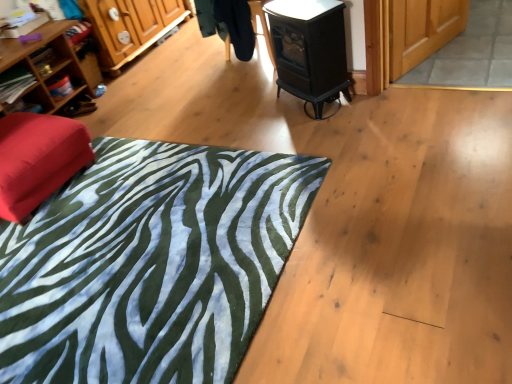
Question: From the image's perspective, would you say wooden bookshelf at left, positioned as the first shelf in top-to-bottom order, is positioned over green zebra-patterned rug at lower left?

Choices:
 (A) no
 (B) yes

Answer: (B)

Question: Is green zebra-patterned rug at lower left a part of wooden bookshelf at left, positioned as the first shelf in top-to-bottom order?

Choices:
 (A) no
 (B) yes

Answer: (A)

Question: From a real-world perspective, is wooden bookshelf at left, positioned as the first shelf in top-to-bottom order, positioned under green zebra-patterned rug at lower left based on gravity?

Choices:
 (A) no
 (B) yes

Answer: (A)

Question: Considering the relative positions of wooden bookshelf at left, positioned as the first shelf in top-to-bottom order, and green zebra-patterned rug at lower left in the image provided, is wooden bookshelf at left, positioned as the first shelf in top-to-bottom order, to the right of green zebra-patterned rug at lower left from the viewer's perspective?

Choices:
 (A) no
 (B) yes

Answer: (A)

Question: Considering the relative sizes of wooden bookshelf at left, arranged as the 3th shelf when ordered from the bottom, and green zebra-patterned rug at lower left in the image provided, is wooden bookshelf at left, arranged as the 3th shelf when ordered from the bottom, thinner than green zebra-patterned rug at lower left?

Choices:
 (A) yes
 (B) no

Answer: (A)

Question: From the image's perspective, is wooden shelf at left, the first shelf in the bottom-to-top sequence, positioned above or below wooden shelf at left, arranged as the 2th shelf when ordered from the bottom?

Choices:
 (A) below
 (B) above

Answer: (A)

Question: Looking at the image, does wooden shelf at left, the first shelf in the bottom-to-top sequence, seem bigger or smaller compared to wooden shelf at left, arranged as the 2th shelf when ordered from the bottom?

Choices:
 (A) small
 (B) big

Answer: (B)

Question: Choose the correct answer: Is wooden shelf at left, the 3th shelf from the top, inside wooden shelf at left, arranged as the 2th shelf when ordered from the bottom, or outside it?

Choices:
 (A) inside
 (B) outside

Answer: (B)

Question: In the image, is wooden shelf at left, the first shelf in the bottom-to-top sequence, positioned in front of or behind wooden shelf at left, the 2th shelf positioned from the top?

Choices:
 (A) behind
 (B) front

Answer: (B)

Question: Is matte wooden screen door at upper right to the left or to the right of green zebra-patterned rug at lower left in the image?

Choices:
 (A) left
 (B) right

Answer: (B)

Question: Relative to green zebra-patterned rug at lower left, is matte wooden screen door at upper right in front or behind?

Choices:
 (A) front
 (B) behind

Answer: (B)

Question: Is point (400, 16) positioned closer to the camera than point (120, 231)?

Choices:
 (A) farther
 (B) closer

Answer: (A)

Question: In terms of width, does matte wooden screen door at upper right look wider or thinner when compared to green zebra-patterned rug at lower left?

Choices:
 (A) thin
 (B) wide

Answer: (A)

Question: From a real-world perspective, is green zebra-patterned rug at lower left positioned above or below wooden bookshelf at left, positioned as the first shelf in top-to-bottom order?

Choices:
 (A) above
 (B) below

Answer: (B)

Question: From their relative heights in the image, would you say green zebra-patterned rug at lower left is taller or shorter than wooden bookshelf at left, positioned as the first shelf in top-to-bottom order?

Choices:
 (A) short
 (B) tall

Answer: (A)